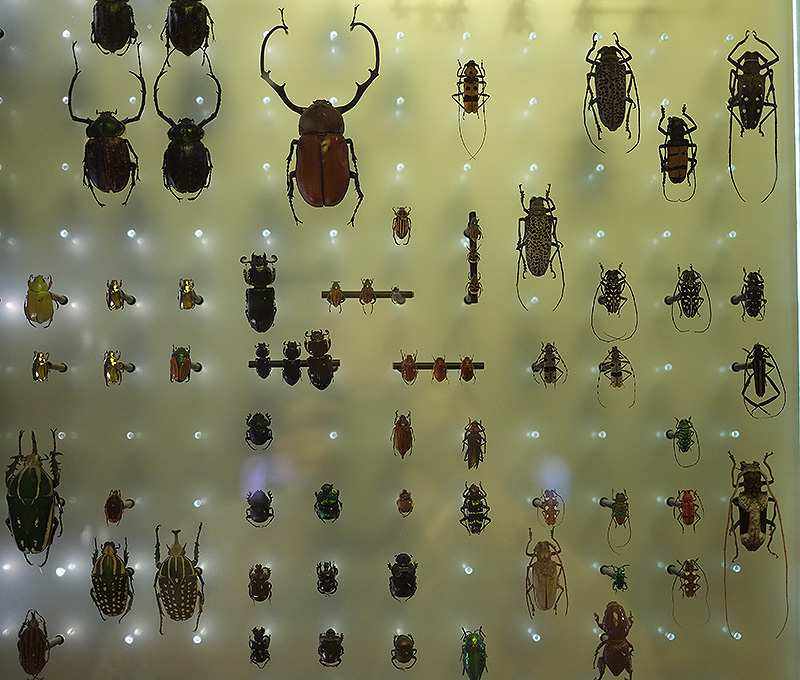
At what (x,y) coordinates should I click in order to perform the action: click on edge of display case. Please return your answer as a coordinate pair (x, y). Looking at the image, I should click on (796, 35).